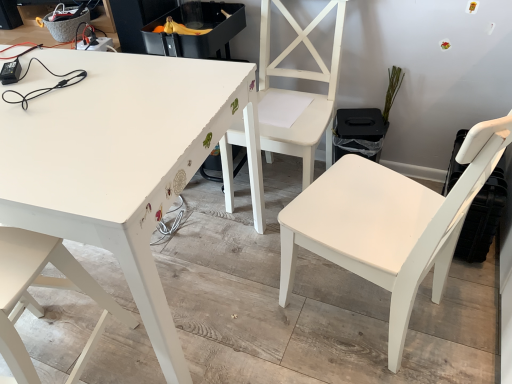
Question: In terms of height, does white painted wood table at upper left look taller or shorter compared to white matte chair at center, the first chair positioned from the right?

Choices:
 (A) tall
 (B) short

Answer: (B)

Question: Would you say white painted wood table at upper left is to the left or to the right of white matte chair at center, arranged as the 3th chair when viewed from the left, in the picture?

Choices:
 (A) left
 (B) right

Answer: (A)

Question: Based on their relative distances, which object is nearer to the white matte chair at center, which is the 2th chair in left-to-right order?

Choices:
 (A) white matte chair at center, the first chair positioned from the right
 (B) white painted wood table at upper left
 (C) white matte chair at lower left, which appears as the 3th chair when viewed from the right

Answer: (B)

Question: Based on their relative distances, which object is farther from the white matte chair at center, the first chair positioned from the right?

Choices:
 (A) white painted wood table at upper left
 (B) white matte chair at center, the 2th chair viewed from the right
 (C) white matte chair at lower left, which appears as the 3th chair when viewed from the right

Answer: (C)